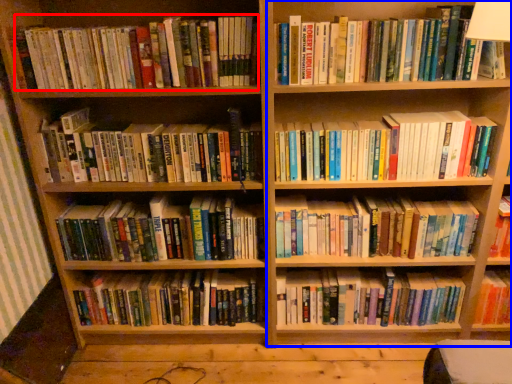
Question: Among these objects, which one is nearest to the camera, book (highlighted by a red box) or bookshelf (highlighted by a blue box)?

Choices:
 (A) book
 (B) bookshelf

Answer: (B)